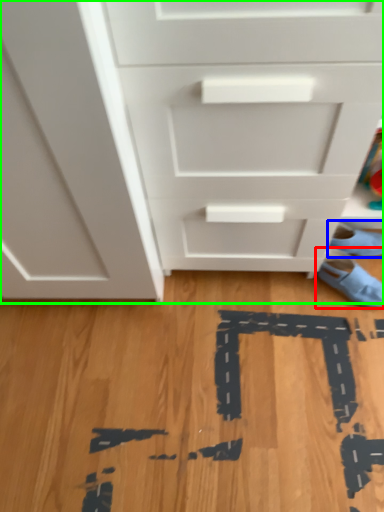
Question: Which object is positioned closest to footwear (highlighted by a red box)? Select from footwear (highlighted by a blue box) and chest of drawers (highlighted by a green box).

Choices:
 (A) footwear
 (B) chest of drawers

Answer: (A)